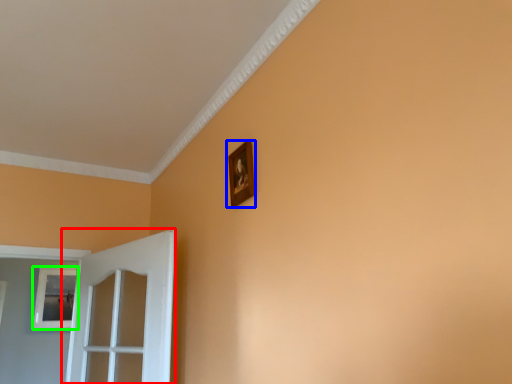
Question: Which is farther away from door (highlighted by a red box)? picture frame (highlighted by a blue box) or picture frame (highlighted by a green box)?

Choices:
 (A) picture frame
 (B) picture frame

Answer: (B)